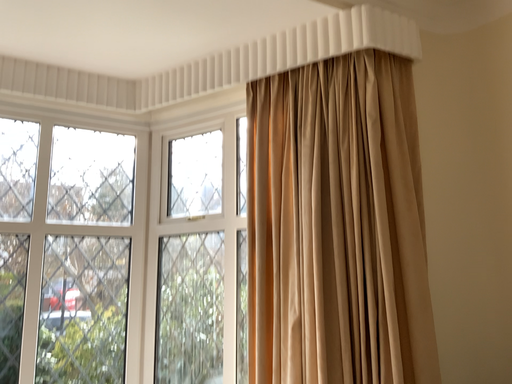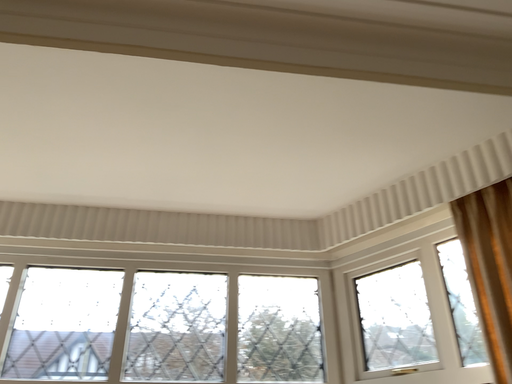
Question: Which way did the camera rotate in the video?

Choices:
 (A) rotated upward
 (B) rotated downward

Answer: (A)